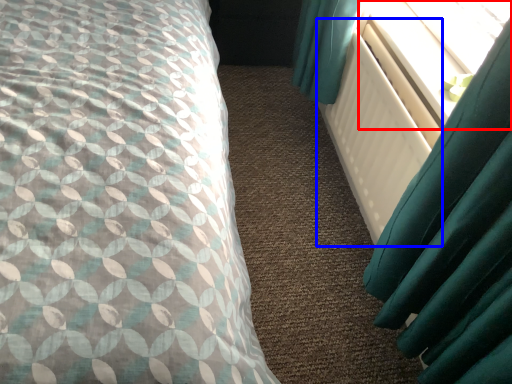
Question: Which point is further to the camera, window screen (highlighted by a red box) or radiator (highlighted by a blue box)?

Choices:
 (A) window screen
 (B) radiator

Answer: (A)